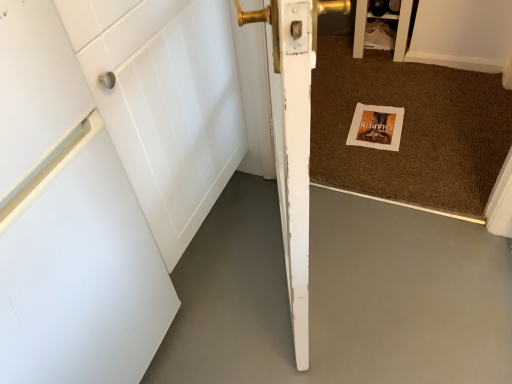
This screenshot has height=384, width=512. In order to click on blank space to the left of white paper postcard at center in this screenshot , I will do `click(333, 134)`.